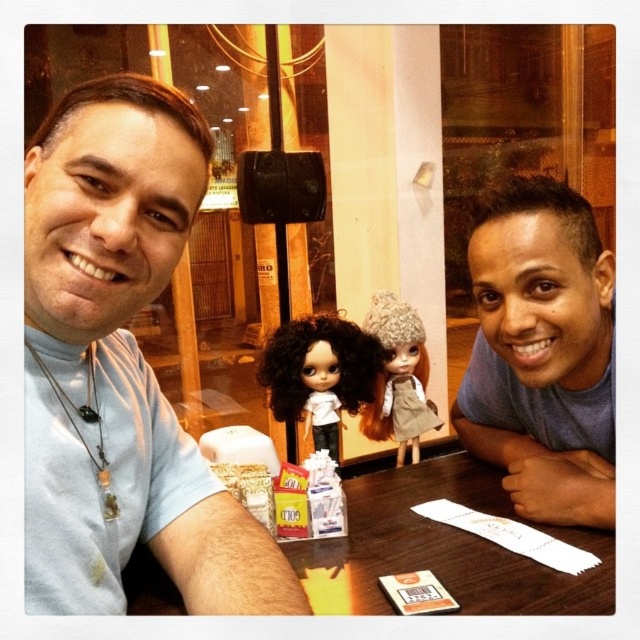
You are sitting at the table between the two people in the image. You want to place a small vase exactly halfway between the point at the bottom left corner of the table and the point at the top right corner of the table. Which of the two points given, point (72, 125) or point (356, 364), is closer to where you should place the vase?

Point (356, 364) is closer to the halfway point between the bottom left and top right corners of the table because it is positioned further towards the center compared to point (72, 125).